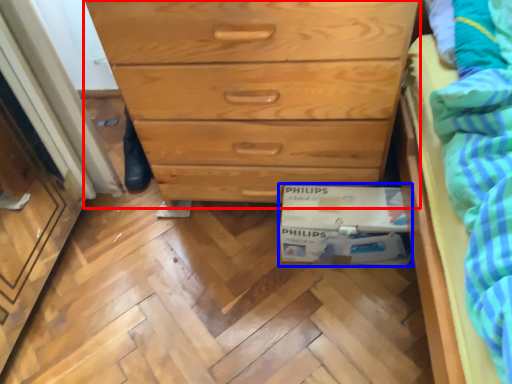
Question: Which object appears farthest to the camera in this image, chest of drawers (highlighted by a red box) or cardboard box (highlighted by a blue box)?

Choices:
 (A) chest of drawers
 (B) cardboard box

Answer: (B)